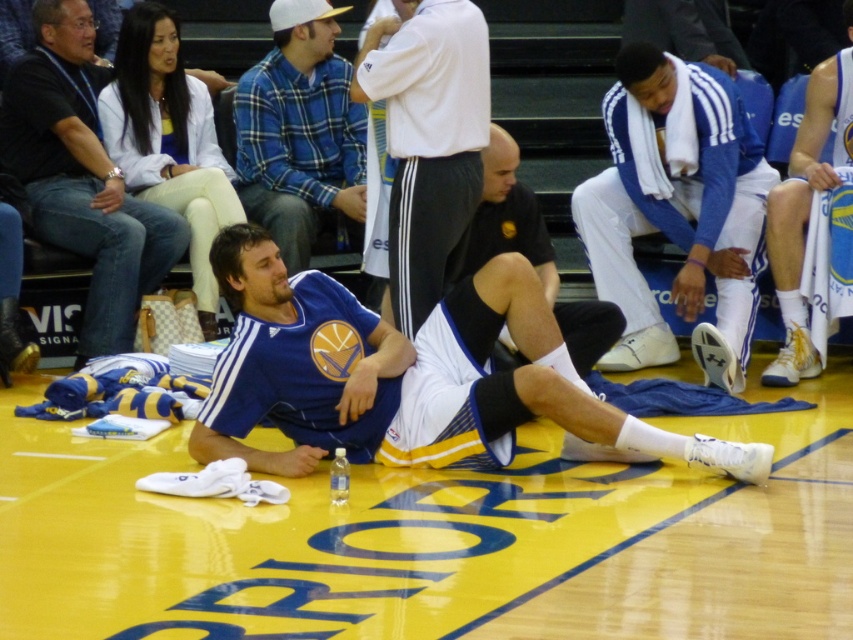
Question: Where is blue jersey at center located in relation to blue/white jersey at center in the image?

Choices:
 (A) left
 (B) right

Answer: (A)

Question: Does blue/white jersey at center lie in front of white jersey at right?

Choices:
 (A) no
 (B) yes

Answer: (B)

Question: Which point is farther to the camera?

Choices:
 (A) (364, 157)
 (B) (810, 134)
 (C) (358, 83)
 (D) (318, 300)

Answer: (A)

Question: Which object is the closest to the blue plaid shirt at upper center?

Choices:
 (A) white jersey at right
 (B) black matte shorts at center
 (C) blue/white jersey at center

Answer: (B)

Question: Does blue jersey at center appear on the right side of blue/white jersey at center?

Choices:
 (A) no
 (B) yes

Answer: (A)

Question: Which is farther from the blue plaid shirt at upper center?

Choices:
 (A) blue jersey at center
 (B) white jersey at right
 (C) white fleece jacket at center

Answer: (B)